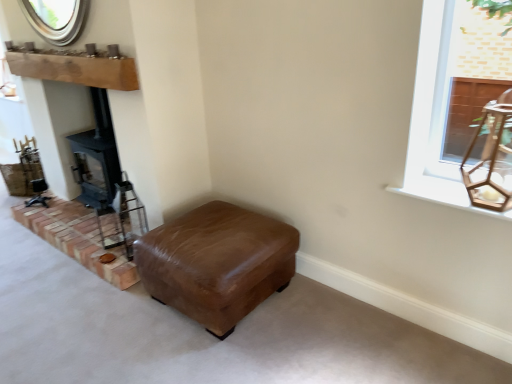
Question: Considering the relative sizes of white wood window sill at upper right and brown leather ottoman at center in the image provided, is white wood window sill at upper right thinner than brown leather ottoman at center?

Choices:
 (A) no
 (B) yes

Answer: (B)

Question: Is white wood window sill at upper right far from brown leather ottoman at center?

Choices:
 (A) yes
 (B) no

Answer: (B)

Question: Considering the relative sizes of white wood window sill at upper right and brown leather ottoman at center in the image provided, is white wood window sill at upper right smaller than brown leather ottoman at center?

Choices:
 (A) no
 (B) yes

Answer: (B)

Question: From the image's perspective, does white wood window sill at upper right appear lower than brown leather ottoman at center?

Choices:
 (A) no
 (B) yes

Answer: (A)

Question: Can you confirm if white wood window sill at upper right is positioned to the left of brown leather ottoman at center?

Choices:
 (A) yes
 (B) no

Answer: (B)

Question: Is white wood window sill at upper right beside brown leather ottoman at center?

Choices:
 (A) no
 (B) yes

Answer: (A)

Question: Is brown brickwork at lower left aimed at natural wood mantle at upper left?

Choices:
 (A) yes
 (B) no

Answer: (B)

Question: Is brown brickwork at lower left positioned with its back to natural wood mantle at upper left?

Choices:
 (A) yes
 (B) no

Answer: (B)

Question: From the image's perspective, is brown brickwork at lower left above natural wood mantle at upper left?

Choices:
 (A) no
 (B) yes

Answer: (A)

Question: From the image's perspective, would you say brown brickwork at lower left is shown under natural wood mantle at upper left?

Choices:
 (A) no
 (B) yes

Answer: (B)

Question: Would you say brown brickwork at lower left is outside natural wood mantle at upper left?

Choices:
 (A) yes
 (B) no

Answer: (A)

Question: Can you confirm if brown brickwork at lower left is bigger than natural wood mantle at upper left?

Choices:
 (A) no
 (B) yes

Answer: (B)

Question: Does natural wood mantle at upper left have a larger size compared to brown leather ottoman at center?

Choices:
 (A) yes
 (B) no

Answer: (B)